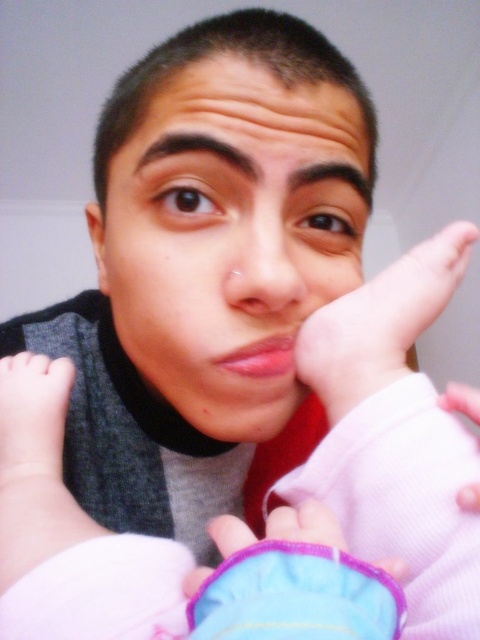
Question: Considering the relative positions of matte skin nose at center and purple fabric glove at lower center in the image provided, where is matte skin nose at center located with respect to purple fabric glove at lower center?

Choices:
 (A) below
 (B) above

Answer: (B)

Question: Can you confirm if pink fabric baby hand at lower left is positioned below pink fabric hand at right?

Choices:
 (A) yes
 (B) no

Answer: (B)

Question: Which point is farther to the camera?

Choices:
 (A) pink fabric baby hand at lower left
 (B) pink fabric baby foot at center
 (C) pink fabric hand at right
 (D) white soft baby arm at lower left

Answer: (C)

Question: Which object appears closest to the camera in this image?

Choices:
 (A) pink fabric baby foot at center
 (B) purple fabric glove at lower center

Answer: (B)

Question: Among these objects, which one is farthest from the camera?

Choices:
 (A) matte skin nose at center
 (B) pink fabric baby hand at lower left
 (C) pink fabric baby foot at center

Answer: (B)

Question: In this image, where is pink fabric baby foot at center located relative to matte skin nose at center?

Choices:
 (A) below
 (B) above

Answer: (A)